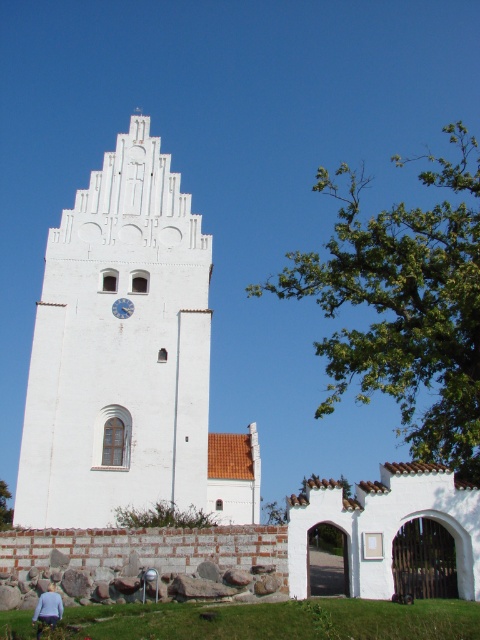
You are standing in front of a church and notice two key features. The first is the white stone church at center, and the second is the white matte clock at center. Based on their positions, which one is located to the right side from your viewpoint?

The white stone church at center is to the right of the white matte clock at center, so the white stone church at center is located to the right side from your viewpoint.

What is the spatial relationship between the white stone church at center and the green leafy tree at upper center in the image?

The white stone church at center is to the right of the green leafy tree at upper center.

You are an architect visiting the church and need to compare the sizes of the white stone church at center and the white matte clock at center. Which one is bigger?

The white stone church at center is larger in size than the white matte clock at center.